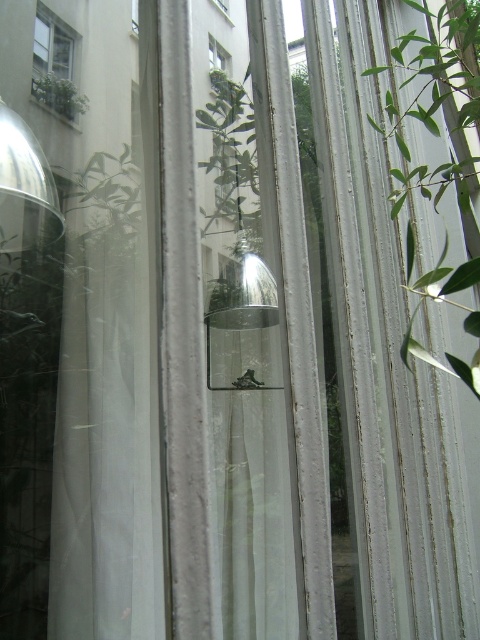
You are standing in a room looking through the window. You see a green leafy plant at center and a green matte window at upper left. Which object is closer to you?

The green leafy plant at center is closer to you because it is further to the viewer than the green matte window at upper left.

You are looking through the window with vertical blinds and see the green leafy plant at upper left and the transparent glass frog at center. Which object is closer to you?

The green leafy plant at upper left is closer to you because it is further to the viewer than the transparent glass frog at center.